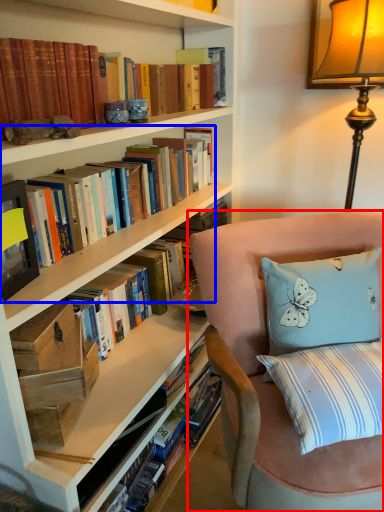
Question: Which object appears closest to the camera in this image, chair (highlighted by a red box) or book (highlighted by a blue box)?

Choices:
 (A) chair
 (B) book

Answer: (A)